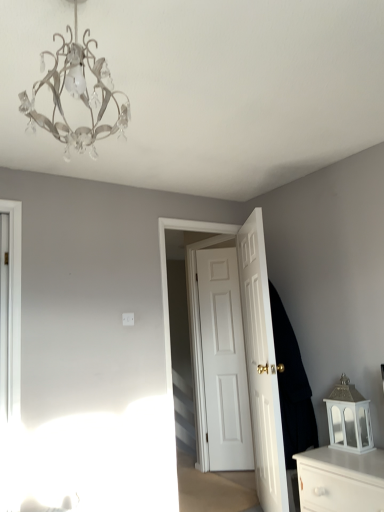
Question: Which direction should I rotate to face white matte door at center, the third door positioned from the front, — up or down?

Choices:
 (A) down
 (B) up

Answer: (A)

Question: Is metallic chandelier at upper left far from white glossy door at center, the 3th door positioned from the back?

Choices:
 (A) no
 (B) yes

Answer: (B)

Question: From the image's perspective, would you say metallic chandelier at upper left is shown under white glossy door at center, the 3th door positioned from the back?

Choices:
 (A) yes
 (B) no

Answer: (B)

Question: Does metallic chandelier at upper left have a lesser width compared to white glossy door at center, the 3th door positioned from the back?

Choices:
 (A) yes
 (B) no

Answer: (B)

Question: Can we say metallic chandelier at upper left lies outside white glossy door at center, the 3th door positioned from the back?

Choices:
 (A) no
 (B) yes

Answer: (B)

Question: Does metallic chandelier at upper left turn towards white glossy door at center, the first door in the front-to-back sequence?

Choices:
 (A) yes
 (B) no

Answer: (B)

Question: Does metallic chandelier at upper left have a smaller size compared to white glossy door at center, the first door in the front-to-back sequence?

Choices:
 (A) no
 (B) yes

Answer: (B)

Question: Is white glossy door at center, the first door in the front-to-back sequence, next to white glossy door at center, which appears as the 2th door when viewed from the front?

Choices:
 (A) yes
 (B) no

Answer: (B)

Question: Can you confirm if white glossy door at center, the 3th door positioned from the back, is thinner than white glossy door at center, the second door positioned from the back?

Choices:
 (A) yes
 (B) no

Answer: (B)

Question: Considering the relative sizes of white glossy door at center, the 3th door positioned from the back, and white glossy door at center, which appears as the 2th door when viewed from the front, in the image provided, is white glossy door at center, the 3th door positioned from the back, taller than white glossy door at center, which appears as the 2th door when viewed from the front,?

Choices:
 (A) no
 (B) yes

Answer: (A)

Question: From a real-world perspective, is white glossy door at center, the first door in the front-to-back sequence, located beneath white glossy door at center, which appears as the 2th door when viewed from the front?

Choices:
 (A) no
 (B) yes

Answer: (B)

Question: Is white glossy door at center, the first door in the front-to-back sequence, outside of white glossy door at center, the second door positioned from the back?

Choices:
 (A) yes
 (B) no

Answer: (A)

Question: Is white glossy door at center, the first door in the front-to-back sequence, bigger than white glossy door at center, the second door positioned from the back?

Choices:
 (A) yes
 (B) no

Answer: (A)

Question: Is white glossy chest of drawers at lower right not within white glossy door at center, the 3th door positioned from the back?

Choices:
 (A) no
 (B) yes

Answer: (B)